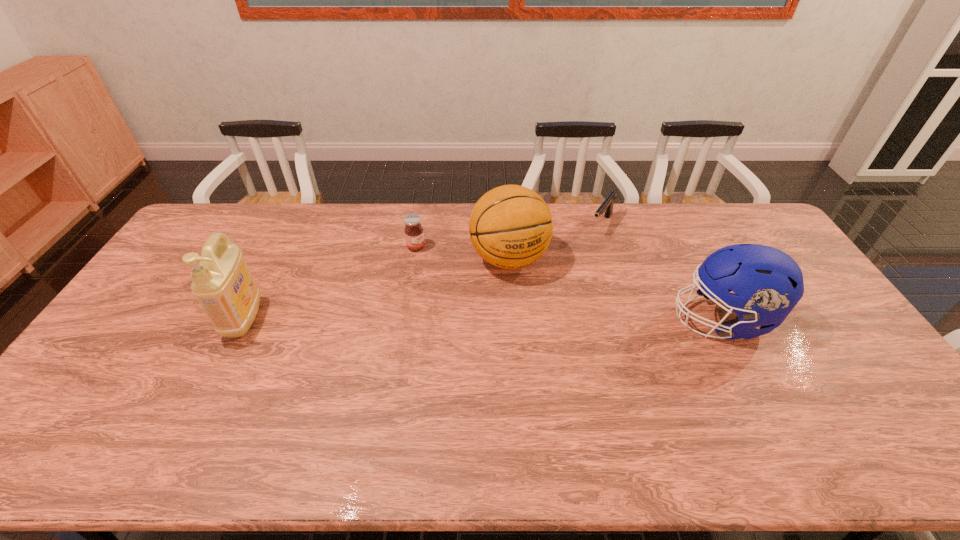
Where is `pistol that is positioned at the far edge`? pistol that is positioned at the far edge is located at coordinates (606, 207).

Identify the location of blank space at the far edge of the desktop. The image size is (960, 540). (579, 242).

Locate an element on the screen. This screenshot has width=960, height=540. vacant space at the near edge of the desktop is located at coordinates (786, 408).

Locate an element on the screen. The image size is (960, 540). free space at the right edge is located at coordinates (828, 326).

Identify the location of free space at the far left corner of the desktop. (225, 224).

You are a GUI agent. You are given a task and a screenshot of the screen. Output one action in this format:
    pyautogui.click(x=<x>, y=<y>)
    Task: Click on the vacant space at the far right corner of the desktop
    The image size is (960, 540).
    Given the screenshot: What is the action you would take?
    pyautogui.click(x=731, y=206)

This screenshot has height=540, width=960. Identify the location of empty space that is in between the detergent and the basketball. (377, 289).

The image size is (960, 540). Find the location of `free space between the pistol and the leftmost object`. free space between the pistol and the leftmost object is located at coordinates (423, 272).

This screenshot has width=960, height=540. What are the coordinates of `vacant area that lies between the rightmost object and the jam` in the screenshot? It's located at pyautogui.click(x=568, y=283).

Where is `free space between the jam and the detergent`? free space between the jam and the detergent is located at coordinates (330, 283).